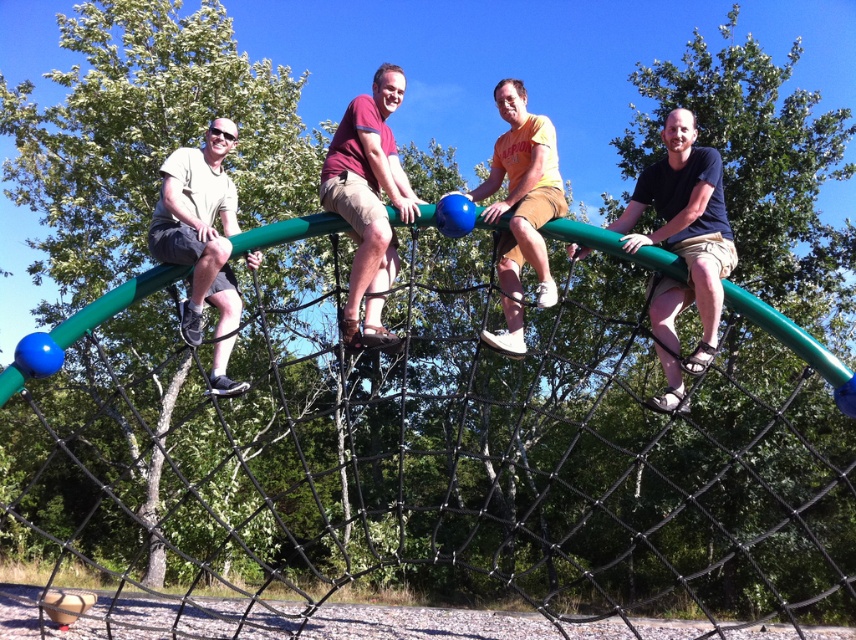
Find the location of a particular element. black matte shorts at upper right is located at coordinates (682, 248).

Who is positioned more to the right, black matte shorts at upper right or matte khaki shorts at left?

black matte shorts at upper right is more to the right.

You are a GUI agent. You are given a task and a screenshot of the screen. Output one action in this format:
    pyautogui.click(x=<x>, y=<y>)
    Task: Click on the black matte shorts at upper right
    
    Given the screenshot: What is the action you would take?
    pyautogui.click(x=682, y=248)

Does point (670, 284) lie in front of point (342, 323)?

No, it is behind (342, 323).

Does black matte shorts at upper right have a larger size compared to matte red shirt at center?

Yes, black matte shorts at upper right is bigger than matte red shirt at center.

I want to click on black matte shorts at upper right, so click(682, 248).

Is matte red shirt at center bigger than orange t-shirt at center?

Yes, matte red shirt at center is bigger than orange t-shirt at center.

Does point (373, 189) lie in front of point (510, 234)?

Yes, it is in front of point (510, 234).

Find the location of a particular element. The image size is (856, 640). matte red shirt at center is located at coordinates (367, 204).

Image resolution: width=856 pixels, height=640 pixels. I want to click on matte red shirt at center, so point(367,204).